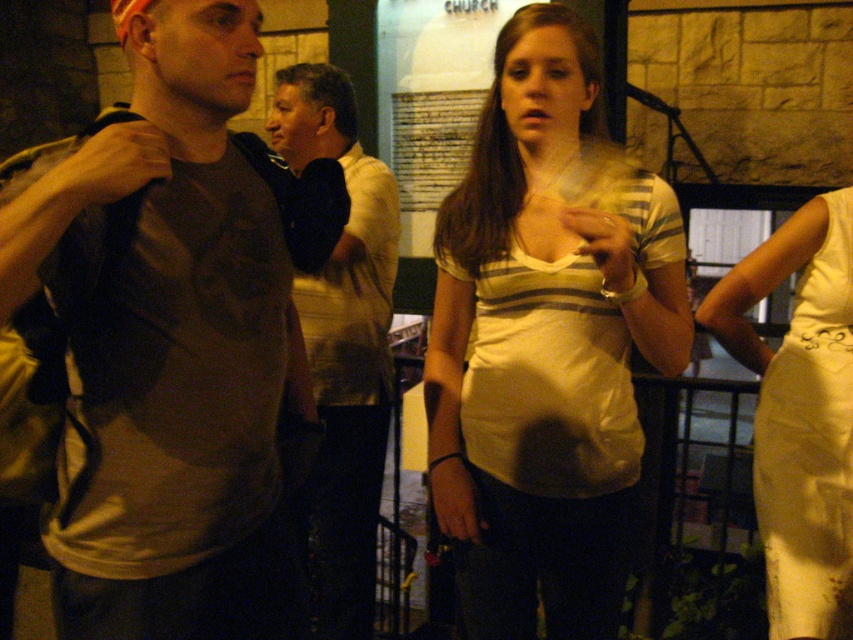
Question: Which point appears farthest from the camera in this image?

Choices:
 (A) (82, 438)
 (B) (656, 221)
 (C) (303, 300)
 (D) (811, 600)

Answer: (C)

Question: Considering the relative positions of matte striped shirt at center and white satin dress at right in the image provided, where is matte striped shirt at center located with respect to white satin dress at right?

Choices:
 (A) right
 (B) left

Answer: (B)

Question: Which of these objects is positioned closest to the white satin dress at right?

Choices:
 (A) light brown shirt at center
 (B) matte striped shirt at center
 (C) matte brown t-shirt at left

Answer: (B)

Question: Which of the following is the closest to the observer?

Choices:
 (A) matte striped shirt at center
 (B) light brown shirt at center

Answer: (A)

Question: Can you confirm if white satin dress at right is positioned to the right of light brown shirt at center?

Choices:
 (A) no
 (B) yes

Answer: (B)

Question: Does matte striped shirt at center appear over white satin dress at right?

Choices:
 (A) yes
 (B) no

Answer: (A)